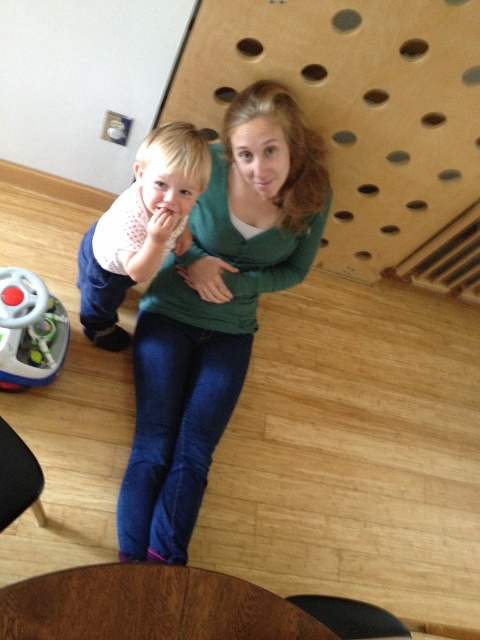
You are a delivery robot with a package that is 15 inches wide. You need to navigate between the green matte sweater at center and the plastic steering wheel at lower left to reach the delivery spot. Can your package fit through the space between them?

The distance between the green matte sweater at center and the plastic steering wheel at lower left is 14.93 inches. Since your package is 15 inches wide, it cannot fit through the space between them as the available space is slightly narrower than the package.

Consider the image. You are trying to locate the green matte sweater at center in the image. According to the scene description, where is it positioned relative to the wooden structure with circular cutouts?

The green matte sweater at center is located at point (216, 310), which is closer to the center of the image compared to the wooden structure with circular cutouts in the background.